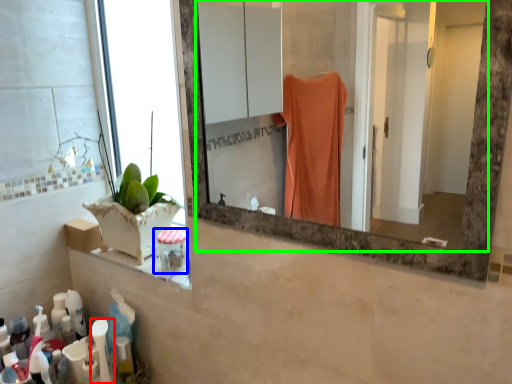
Question: Which is nearer to the toiletry (highlighted by a red box)? toiletry (highlighted by a blue box) or mirror (highlighted by a green box).

Choices:
 (A) toiletry
 (B) mirror

Answer: (A)